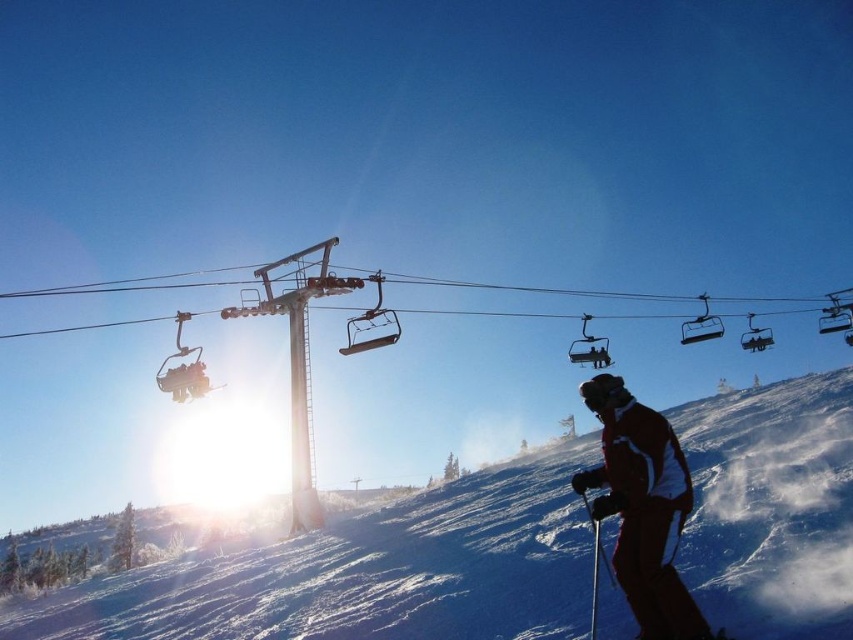
You are a photographer trying to capture a photo of the two points in the scene. The first point is at coordinate point(660, 579) and the second point is at point(582, 355). Which point will appear larger in your photo?

Point(660, 579) is closer to the camera than point(582, 355), so it will appear larger in the photo.

You are a photographer standing at the bottom of the slope. You want to take a photo of the two points mentioned in the scene. Which point is closer to you, point [485,531] or point [595,339]?

Point [485,531] is closer to you than point [595,339].

You are a skier navigating a slope and want to reach the finish line marked by point A at point (821, 612) and point B at point (625, 570). Which point is closer to your current position if you are standing behind both points?

Point B at point (625, 570) is closer because it is in front of point A at point (821, 612), so you would reach point B first.